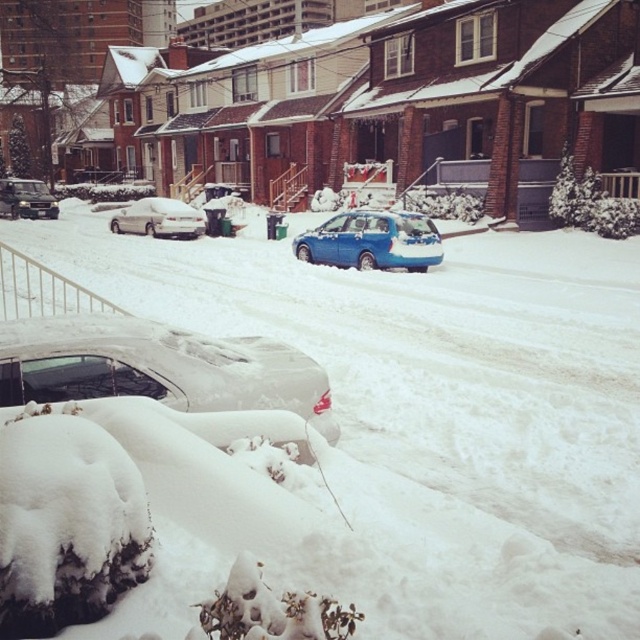
Question: Among these objects, which one is farthest from the camera?

Choices:
 (A) white fluffy snow at lower left
 (B) white matte sedan at center
 (C) matte black suv at left
 (D) blue matte van at center

Answer: (C)

Question: Which is farther from the blue matte van at center?

Choices:
 (A) matte black suv at left
 (B) snow-covered silver sedan at lower left

Answer: (A)

Question: Is white matte sedan at center to the left of matte black suv at left from the viewer's perspective?

Choices:
 (A) yes
 (B) no

Answer: (B)

Question: Can you confirm if blue matte van at center is thinner than white matte sedan at center?

Choices:
 (A) no
 (B) yes

Answer: (B)

Question: Among these objects, which one is farthest from the camera?

Choices:
 (A) matte black suv at left
 (B) white matte sedan at center
 (C) blue matte van at center

Answer: (A)

Question: Is the position of blue matte van at center less distant than that of matte black suv at left?

Choices:
 (A) no
 (B) yes

Answer: (B)